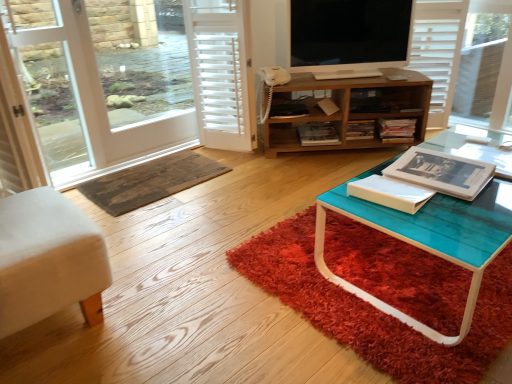
This screenshot has height=384, width=512. Find the location of `vacant area that lies to the right of white fabric cushion at lower left`. vacant area that lies to the right of white fabric cushion at lower left is located at coordinates (160, 301).